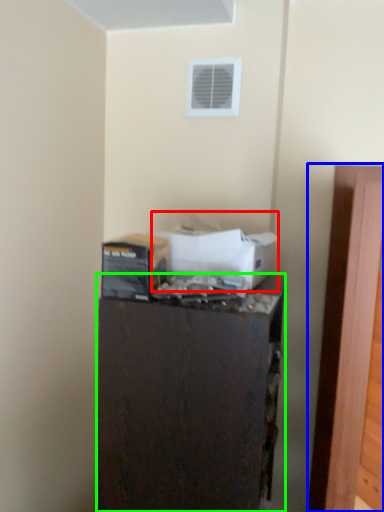
Question: Considering the real-world distances, which object is farthest from box (highlighted by a red box)? door (highlighted by a blue box) or furniture (highlighted by a green box)?

Choices:
 (A) door
 (B) furniture

Answer: (A)